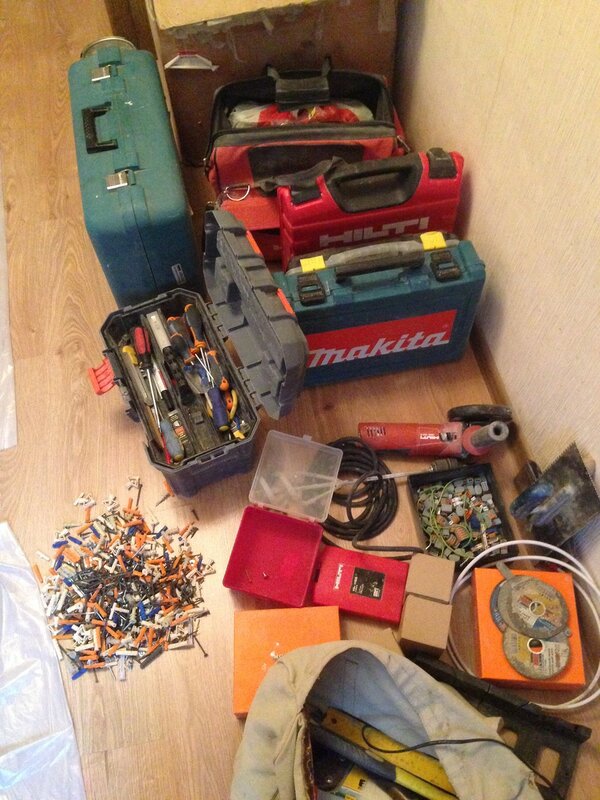
Identify the location of 1 wooden surface. The image size is (600, 800). click(78, 440).